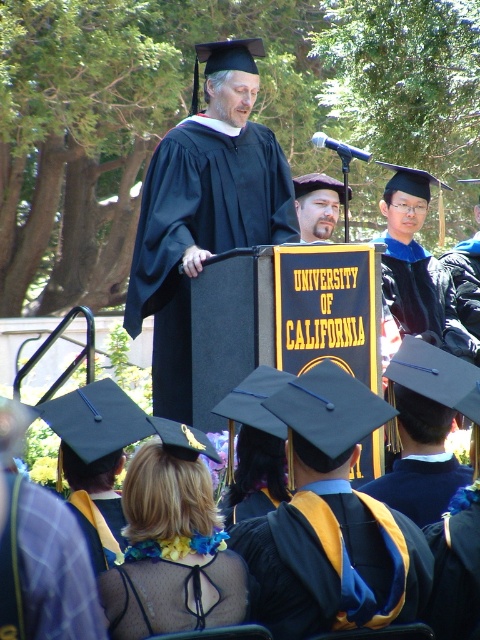
Question: Which is nearer to the plaid wool robe at lower left?

Choices:
 (A) matte black gown at center
 (B) black matte graduation gown at center
 (C) black mesh dress at center

Answer: (C)

Question: In this image, where is matte black gown at center located relative to black mesh dress at center?

Choices:
 (A) right
 (B) left

Answer: (B)

Question: In this image, where is matte black gown at center located relative to plaid wool robe at lower left?

Choices:
 (A) right
 (B) left

Answer: (A)

Question: Which object appears closest to the camera in this image?

Choices:
 (A) bearded man at center
 (B) black mesh dress at center
 (C) plaid wool robe at lower left
 (D) matte black gown at center

Answer: (C)

Question: Can you confirm if matte black gown at center is smaller than bearded man at center?

Choices:
 (A) no
 (B) yes

Answer: (B)

Question: Which is nearer to the plaid wool robe at lower left?

Choices:
 (A) bearded man at center
 (B) black mesh dress at center
 (C) matte black gown at center
 (D) black matte graduation gown at center

Answer: (B)